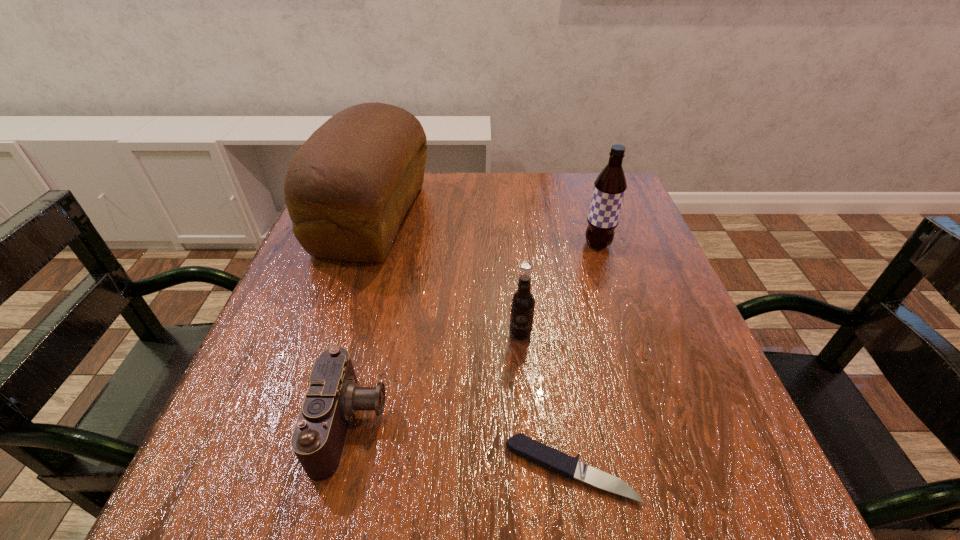
The image size is (960, 540). I want to click on free point that satisfies the following two spatial constraints: 1. on the label of the third shortest object; 2. on the front-facing side of the second shortest object, so click(528, 423).